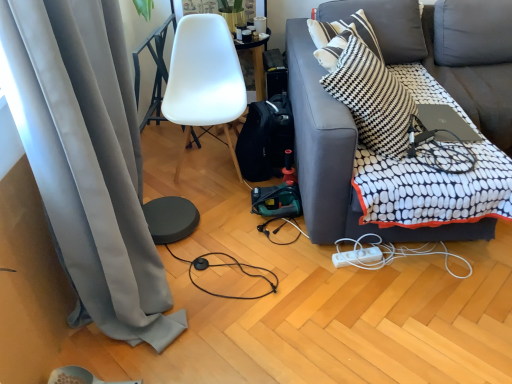
Question: Is point (178, 94) positioned closer to the camera than point (298, 114)?

Choices:
 (A) farther
 (B) closer

Answer: (A)

Question: From a real-world perspective, is white matte chair at center physically located above or below dark gray fabric couch at right?

Choices:
 (A) above
 (B) below

Answer: (B)

Question: Estimate the real-world distances between objects in this image. Which object is closer to the white plastic power strip at lower right?

Choices:
 (A) black and white checkered pillow at upper right
 (B) dark gray fabric couch at right
 (C) silver metallic laptop at upper right
 (D) black cable at lower center
 (E) gray fabric curtain at left

Answer: (B)

Question: Which object is the farthest from the silver metallic laptop at upper right?

Choices:
 (A) white plastic power outlet at lower center
 (B) gray fabric curtain at left
 (C) white plastic power strip at lower right
 (D) black and white checkered pillow at upper right
 (E) black cable at lower center

Answer: (B)